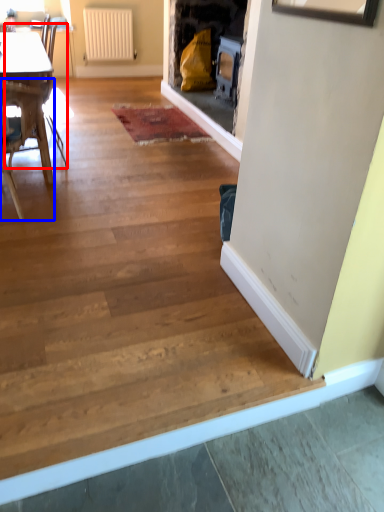
Question: Which object appears closest to the camera in this image, armchair (highlighted by a red box) or chair (highlighted by a blue box)?

Choices:
 (A) armchair
 (B) chair

Answer: (B)